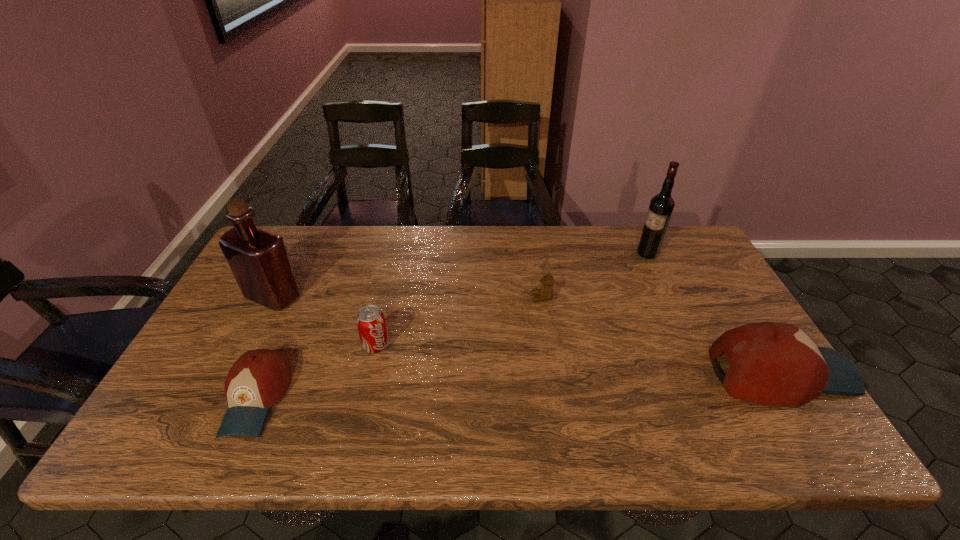
Where is `free space between the taller baseball cap and the left baseball cap`? The image size is (960, 540). free space between the taller baseball cap and the left baseball cap is located at coordinates (518, 386).

Find the location of a particular element. The height and width of the screenshot is (540, 960). vacant area that lies between the fourth shortest object and the liquor is located at coordinates (527, 335).

I want to click on free space between the soda and the wine bottle, so click(x=512, y=299).

Image resolution: width=960 pixels, height=540 pixels. Find the location of `vacant area between the teddy bear and the liquor`. vacant area between the teddy bear and the liquor is located at coordinates (408, 297).

Where is `free space between the liquor and the shorter baseball cap`? free space between the liquor and the shorter baseball cap is located at coordinates (265, 347).

Image resolution: width=960 pixels, height=540 pixels. Find the location of `unoccupied area between the farthest object and the right baseball cap`. unoccupied area between the farthest object and the right baseball cap is located at coordinates (714, 313).

At what (x,y) coordinates should I click in order to perform the action: click on free spot between the right baseball cap and the liquor. Please return your answer as a coordinate pair (x, y). This screenshot has width=960, height=540. Looking at the image, I should click on (527, 335).

Image resolution: width=960 pixels, height=540 pixels. I want to click on vacant area that lies between the liquor and the teddy bear, so click(408, 297).

Identify the location of free space between the teddy bear and the third tallest object. The height and width of the screenshot is (540, 960). tap(661, 336).

Find the location of a particular element. The image size is (960, 540). object that is the fifth closest one to the fourth object from left to right is located at coordinates pos(259,260).